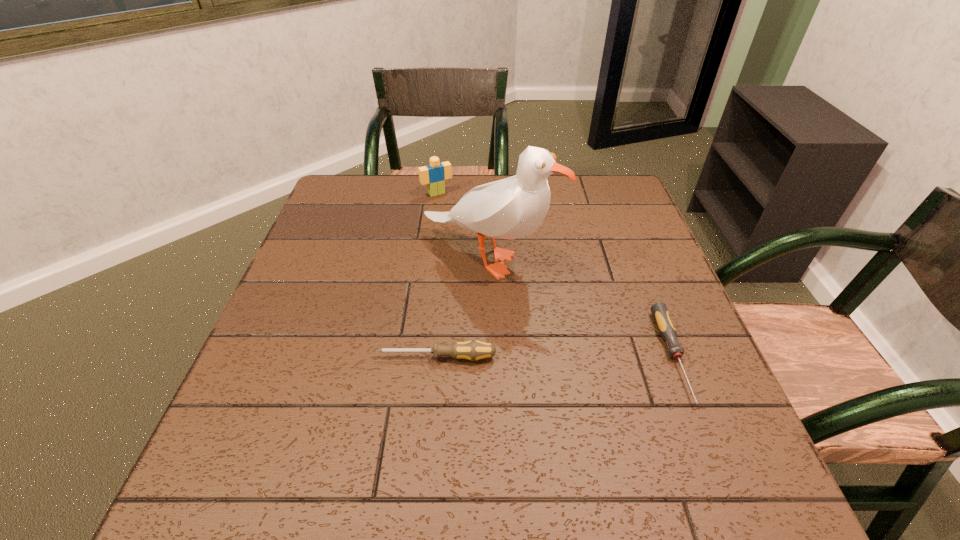
What are the coordinates of `vacant space situated insert the shorter screwdriver into a screw head` in the screenshot? It's located at (705, 435).

Image resolution: width=960 pixels, height=540 pixels. Find the location of `vacant space located 0.060m on the face of the Lego`. vacant space located 0.060m on the face of the Lego is located at coordinates (450, 209).

Locate an element on the screen. The image size is (960, 540). free point located on the face of the Lego is located at coordinates (466, 230).

I want to click on blank space located on the face of the Lego, so click(456, 216).

This screenshot has height=540, width=960. I want to click on vacant area located at the beak of the second farthest object, so click(643, 412).

Locate an element on the screen. This screenshot has width=960, height=540. free region located 0.080m at the beak of the second farthest object is located at coordinates (543, 305).

This screenshot has width=960, height=540. I want to click on vacant region located 0.060m at the beak of the second farthest object, so pyautogui.click(x=538, y=300).

Identify the location of object that is at the far edge. (435, 174).

Where is `object that is at the near edge`? object that is at the near edge is located at coordinates (665, 325).

Identify the location of object at the right edge. This screenshot has width=960, height=540. (665, 325).